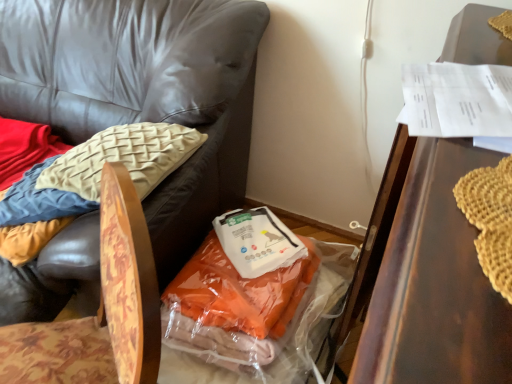
Looking at this image, how much space does wooden textured chair at lower left, arranged as the first chair when viewed from the left, occupy vertically?

wooden textured chair at lower left, arranged as the first chair when viewed from the left, is 34.85 inches in height.

Find the location of a particular element. Image resolution: width=512 pixels, height=384 pixels. wooden textured chair at lower left, positioned as the 2th chair in right-to-left order is located at coordinates (144, 92).

Find the location of a particular element. The height and width of the screenshot is (384, 512). translucent plastic bag at center is located at coordinates (257, 241).

Is wooden textured chair at lower left, arranged as the first chair when viewed from the left, far from translucent plastic bag at center?

wooden textured chair at lower left, arranged as the first chair when viewed from the left, is actually quite close to translucent plastic bag at center.

Does point (59, 8) appear closer or farther from the camera than point (306, 320)?

Point (59, 8) is positioned farther from the camera compared to point (306, 320).

Between wooden textured chair at lower left, arranged as the first chair when viewed from the left, and translucent plastic bag at center, which one has more height?

wooden textured chair at lower left, arranged as the first chair when viewed from the left.

Relative to translucent plastic bag at center, is wooden textured chair at lower left, positioned as the 2th chair in right-to-left order, in front or behind?

Visually, wooden textured chair at lower left, positioned as the 2th chair in right-to-left order, is located in front of translucent plastic bag at center.

In order to click on chair below the translucent plastic bag at center (from the image's perspective) in this screenshot , I will do `click(104, 309)`.

Considering their positions, is floral fabric chair at lower left, the second chair positioned from the left, located in front of or behind translucent plastic bag at center?

Visually, floral fabric chair at lower left, the second chair positioned from the left, is located in front of translucent plastic bag at center.

Which object is positioned more to the left, floral fabric chair at lower left, which is counted as the 1th chair, starting from the right, or translucent plastic bag at center?

From the viewer's perspective, floral fabric chair at lower left, which is counted as the 1th chair, starting from the right, appears more on the left side.

Based on the photo, between floral fabric chair at lower left, which is counted as the 1th chair, starting from the right, and translucent plastic bag at center, which one has larger width?

With larger width is translucent plastic bag at center.

Can you confirm if translucent plastic bag at center is smaller than wooden textured chair at lower left, positioned as the 2th chair in right-to-left order?

Yes.

Could you tell me if translucent plastic bag at center is turned towards wooden textured chair at lower left, positioned as the 2th chair in right-to-left order?

No, translucent plastic bag at center is not oriented towards wooden textured chair at lower left, positioned as the 2th chair in right-to-left order.

Does translucent plastic bag at center lie in front of wooden textured chair at lower left, arranged as the first chair when viewed from the left?

No, it is behind wooden textured chair at lower left, arranged as the first chair when viewed from the left.

Which object is closer to the camera taking this photo, translucent plastic bag at center or translucent plastic bag at center?

translucent plastic bag at center.

From a real-world perspective, between translucent plastic bag at center and translucent plastic bag at center, who is vertically lower?

From a 3D spatial view, translucent plastic bag at center is below.

How different are the orientations of translucent plastic bag at center and translucent plastic bag at center in degrees?

41.2 degrees separate the facing orientations of translucent plastic bag at center and translucent plastic bag at center.

Is point (150, 380) positioned in front of point (229, 217)?

Yes, it is in front of point (229, 217).

Based on the photo, from the image's perspective, is floral fabric chair at lower left, the second chair positioned from the left, under translucent plastic bag at center?

Indeed, from the image's perspective, floral fabric chair at lower left, the second chair positioned from the left, is shown beneath translucent plastic bag at center.

Where is `food above the floral fabric chair at lower left, the second chair positioned from the left (from the image's perspective)`? This screenshot has width=512, height=384. food above the floral fabric chair at lower left, the second chair positioned from the left (from the image's perspective) is located at coordinates pyautogui.click(x=257, y=241).

From a real-world perspective, is floral fabric chair at lower left, the second chair positioned from the left, positioned above or below translucent plastic bag at center?

floral fabric chair at lower left, the second chair positioned from the left, is above translucent plastic bag at center.

Is floral fabric chair at lower left, which is counted as the 1th chair, starting from the right, next to wooden textured chair at lower left, arranged as the first chair when viewed from the left, and touching it?

No, floral fabric chair at lower left, which is counted as the 1th chair, starting from the right, is not with wooden textured chair at lower left, arranged as the first chair when viewed from the left.

Does point (116, 168) lie behind point (105, 105)?

No.

Is floral fabric chair at lower left, the second chair positioned from the left, spatially inside wooden textured chair at lower left, arranged as the first chair when viewed from the left, or outside of it?

floral fabric chair at lower left, the second chair positioned from the left, is not enclosed by wooden textured chair at lower left, arranged as the first chair when viewed from the left.

Considering the relative positions of floral fabric chair at lower left, the second chair positioned from the left, and wooden textured chair at lower left, positioned as the 2th chair in right-to-left order, in the image provided, is floral fabric chair at lower left, the second chair positioned from the left, to the right of wooden textured chair at lower left, positioned as the 2th chair in right-to-left order, from the viewer's perspective?

Yes.

Is translucent plastic bag at center aimed at translucent plastic bag at center?

No, translucent plastic bag at center is not aimed at translucent plastic bag at center.

Is translucent plastic bag at center a part of translucent plastic bag at center?

Yes, translucent plastic bag at center contains translucent plastic bag at center.

Considering the positions of objects translucent plastic bag at center and translucent plastic bag at center in the image provided, who is more to the right, translucent plastic bag at center or translucent plastic bag at center?

Positioned to the right is translucent plastic bag at center.

In the image, is translucent plastic bag at center positioned in front of or behind translucent plastic bag at center?

translucent plastic bag at center is in front of translucent plastic bag at center.

The width and height of the screenshot is (512, 384). Identify the location of chair that is the 1st one when counting forward from the translucent plastic bag at center. (144, 92).

From a real-world perspective, count 1st chairs upward from the translucent plastic bag at center and point to it. Please provide its 2D coordinates.

[(104, 309)]

Estimate the real-world distances between objects in this image. Which object is further from translucent plastic bag at center, floral fabric chair at lower left, which is counted as the 1th chair, starting from the right, or translucent plastic bag at center?

The object further to translucent plastic bag at center is floral fabric chair at lower left, which is counted as the 1th chair, starting from the right.

From the picture: Considering their positions, is translucent plastic bag at center positioned closer to floral fabric chair at lower left, which is counted as the 1th chair, starting from the right, than translucent plastic bag at center?

translucent plastic bag at center is closer to floral fabric chair at lower left, which is counted as the 1th chair, starting from the right.

Considering their positions, is translucent plastic bag at center positioned closer to wooden textured chair at lower left, positioned as the 2th chair in right-to-left order, than floral fabric chair at lower left, the second chair positioned from the left?

translucent plastic bag at center is positioned closer to the anchor wooden textured chair at lower left, positioned as the 2th chair in right-to-left order.

Considering their positions, is floral fabric chair at lower left, the second chair positioned from the left, positioned further to translucent plastic bag at center than translucent plastic bag at center?

Based on the image, floral fabric chair at lower left, the second chair positioned from the left, appears to be further to translucent plastic bag at center.

Which object lies nearer to the anchor point translucent plastic bag at center, translucent plastic bag at center or floral fabric chair at lower left, the second chair positioned from the left?

translucent plastic bag at center is closer to translucent plastic bag at center.

Estimate the real-world distances between objects in this image. Which object is further from wooden textured chair at lower left, positioned as the 2th chair in right-to-left order, floral fabric chair at lower left, the second chair positioned from the left, or translucent plastic bag at center?

floral fabric chair at lower left, the second chair positioned from the left, is further to wooden textured chair at lower left, positioned as the 2th chair in right-to-left order.

Estimate the real-world distances between objects in this image. Which object is further from wooden textured chair at lower left, arranged as the first chair when viewed from the left, floral fabric chair at lower left, which is counted as the 1th chair, starting from the right, or translucent plastic bag at center?

floral fabric chair at lower left, which is counted as the 1th chair, starting from the right, is positioned further to the anchor wooden textured chair at lower left, arranged as the first chair when viewed from the left.

Looking at this image, when comparing their distances from translucent plastic bag at center, does translucent plastic bag at center or wooden textured chair at lower left, arranged as the first chair when viewed from the left, seem closer?

translucent plastic bag at center.

Locate an element on the screen. food between wooden textured chair at lower left, positioned as the 2th chair in right-to-left order, and translucent plastic bag at center, in the horizontal direction is located at coordinates (257, 241).

Find the location of `chair situated between wooden textured chair at lower left, positioned as the 2th chair in right-to-left order, and translucent plastic bag at center from left to right`. chair situated between wooden textured chair at lower left, positioned as the 2th chair in right-to-left order, and translucent plastic bag at center from left to right is located at coordinates (104, 309).

Locate an element on the screen. This screenshot has width=512, height=384. garbage between floral fabric chair at lower left, which is counted as the 1th chair, starting from the right, and translucent plastic bag at center from front to back is located at coordinates (251, 306).

The height and width of the screenshot is (384, 512). Identify the location of chair situated between wooden textured chair at lower left, arranged as the first chair when viewed from the left, and translucent plastic bag at center from left to right. pos(104,309).